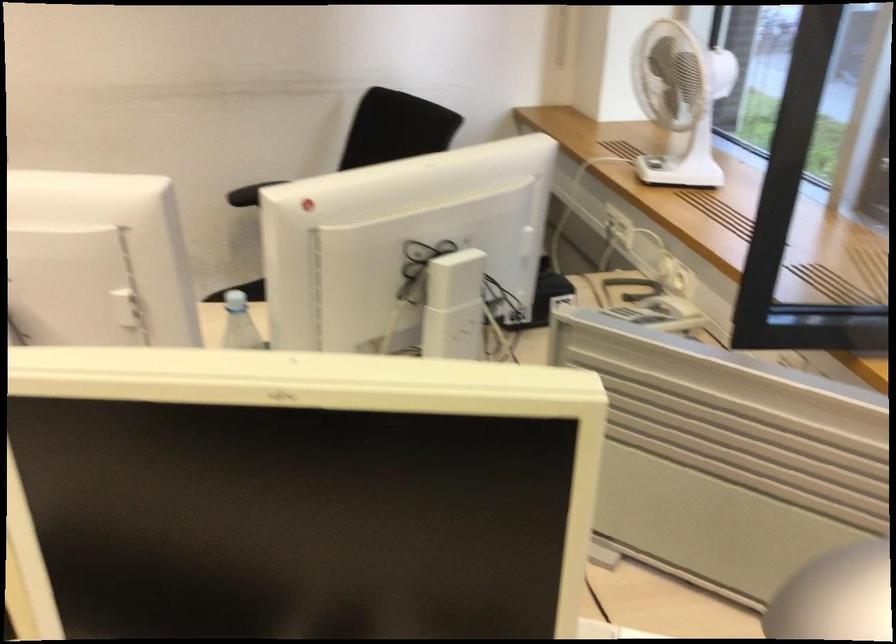
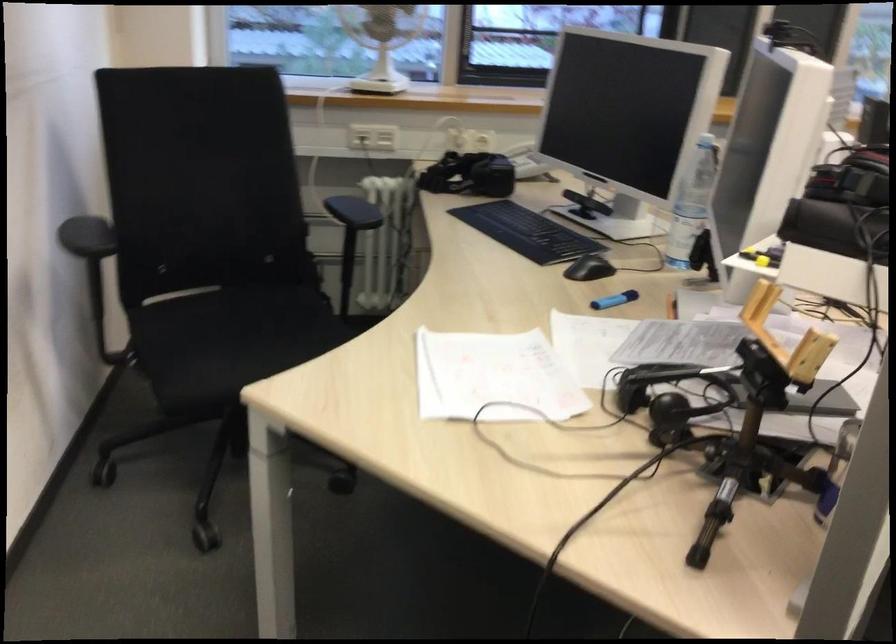
Find the pixel in the second image that matches point 676,314 in the first image.

(519, 149)